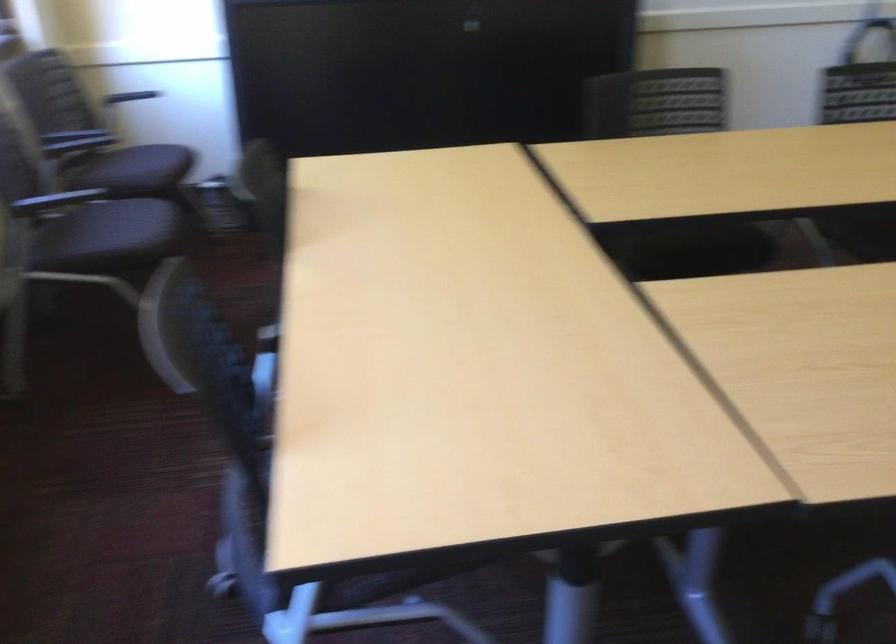
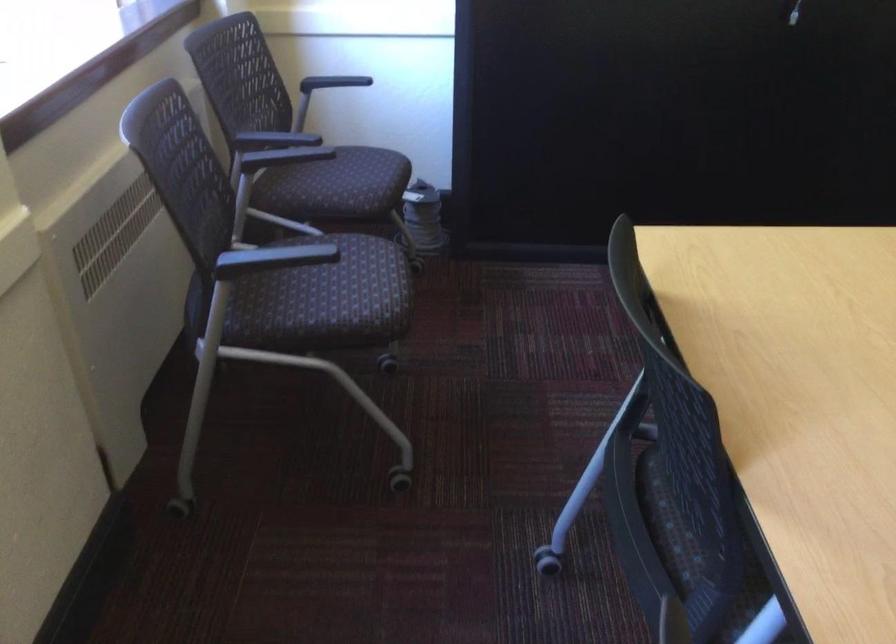
What movement of the cameraman would produce the second image?

The movement direction of the cameraman is left, forward.